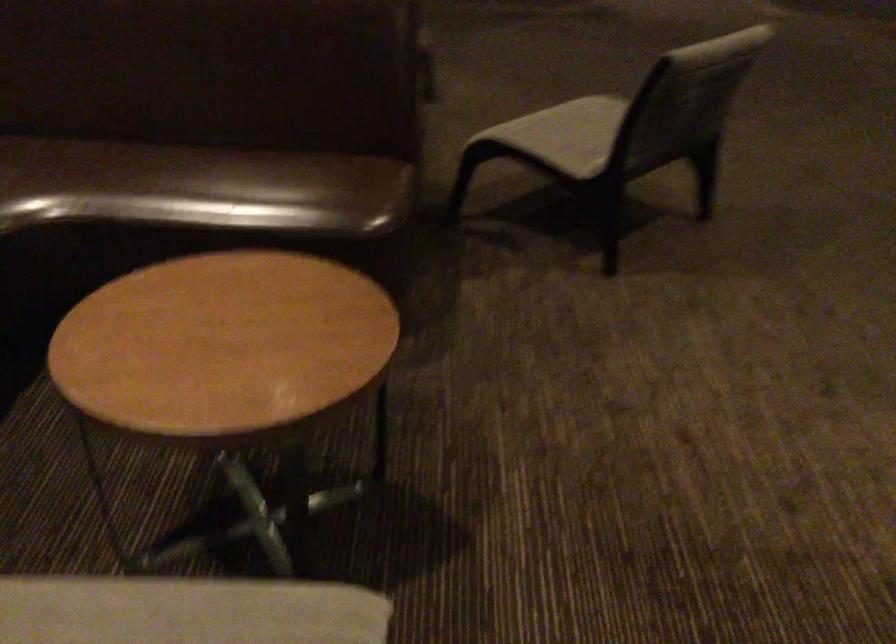
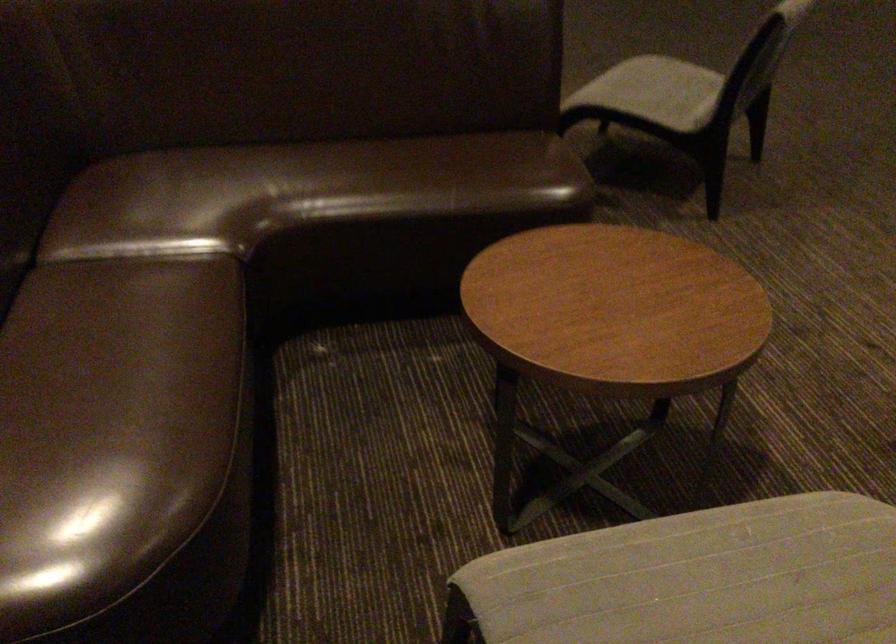
Locate, in the second image, the point that corresponds to point (567, 138) in the first image.

(655, 91)